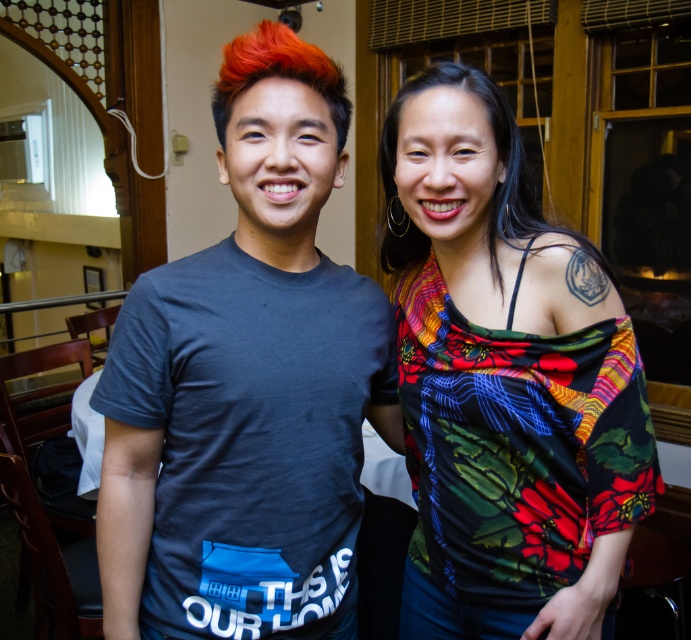
Question: Can you confirm if dark gray t-shirt at left is positioned to the right of black silky hair at upper right?

Choices:
 (A) no
 (B) yes

Answer: (A)

Question: Does floral print top at center lie in front of bright orange hair at center?

Choices:
 (A) yes
 (B) no

Answer: (B)

Question: Which point is farther to the camera?

Choices:
 (A) (321, 52)
 (B) (240, 445)
 (C) (518, 438)

Answer: (C)

Question: Does dark gray t-shirt at left lie in front of floral print top at center?

Choices:
 (A) yes
 (B) no

Answer: (A)

Question: Which point appears farthest from the camera in this image?

Choices:
 (A) (406, 88)
 (B) (504, 108)
 (C) (211, 584)

Answer: (A)

Question: Which object is farther from the camera taking this photo?

Choices:
 (A) black silky hair at upper right
 (B) floral print top at center

Answer: (A)